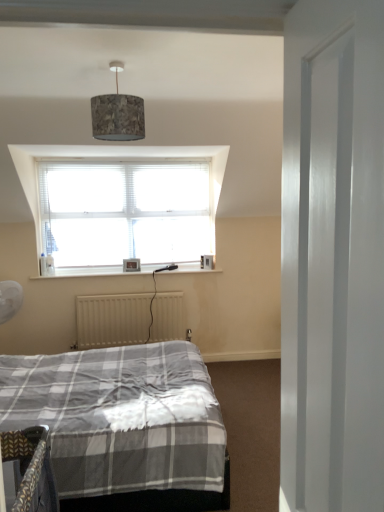
Question: Does textured fabric lampshade at upper center appear on the right side of beige matte radiator at lower center?

Choices:
 (A) yes
 (B) no

Answer: (A)

Question: Is textured fabric lampshade at upper center closer to the viewer compared to beige matte radiator at lower center?

Choices:
 (A) yes
 (B) no

Answer: (A)

Question: Is textured fabric lampshade at upper center looking in the opposite direction of beige matte radiator at lower center?

Choices:
 (A) no
 (B) yes

Answer: (A)

Question: Considering the relative sizes of textured fabric lampshade at upper center and beige matte radiator at lower center in the image provided, is textured fabric lampshade at upper center smaller than beige matte radiator at lower center?

Choices:
 (A) no
 (B) yes

Answer: (B)

Question: Does textured fabric lampshade at upper center have a greater height compared to beige matte radiator at lower center?

Choices:
 (A) no
 (B) yes

Answer: (A)

Question: From the image's perspective, is textured fabric lampshade at upper center over beige matte radiator at lower center?

Choices:
 (A) yes
 (B) no

Answer: (A)

Question: Can you confirm if beige matte radiator at lower center is shorter than textured fabric lampshade at upper center?

Choices:
 (A) yes
 (B) no

Answer: (B)

Question: From the image's perspective, does beige matte radiator at lower center appear higher than textured fabric lampshade at upper center?

Choices:
 (A) yes
 (B) no

Answer: (B)

Question: Is beige matte radiator at lower center to the left of textured fabric lampshade at upper center from the viewer's perspective?

Choices:
 (A) no
 (B) yes

Answer: (B)

Question: Considering the relative sizes of beige matte radiator at lower center and textured fabric lampshade at upper center in the image provided, is beige matte radiator at lower center smaller than textured fabric lampshade at upper center?

Choices:
 (A) no
 (B) yes

Answer: (A)

Question: Is beige matte radiator at lower center taller than textured fabric lampshade at upper center?

Choices:
 (A) yes
 (B) no

Answer: (A)

Question: Is beige matte radiator at lower center positioned with its back to textured fabric lampshade at upper center?

Choices:
 (A) no
 (B) yes

Answer: (A)

Question: In the image, is textured fabric lampshade at upper center on the left side or the right side of beige matte radiator at lower center?

Choices:
 (A) left
 (B) right

Answer: (B)